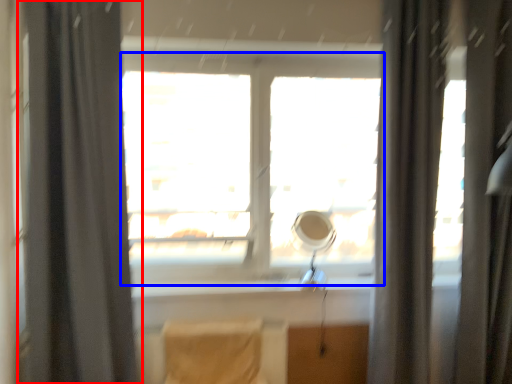
Question: Which object appears closest to the camera in this image, curtain (highlighted by a red box) or window (highlighted by a blue box)?

Choices:
 (A) curtain
 (B) window

Answer: (A)